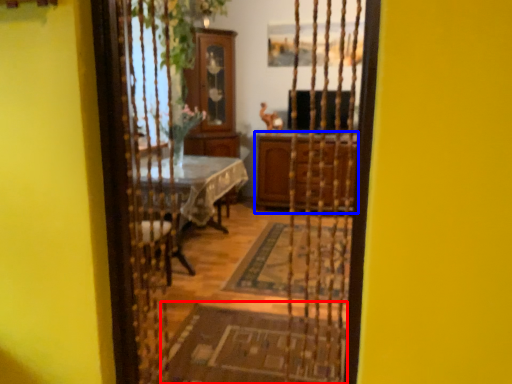
Question: Which of the following is the farthest to the observer, doormat (highlighted by a red box) or cabinetry (highlighted by a blue box)?

Choices:
 (A) doormat
 (B) cabinetry

Answer: (B)